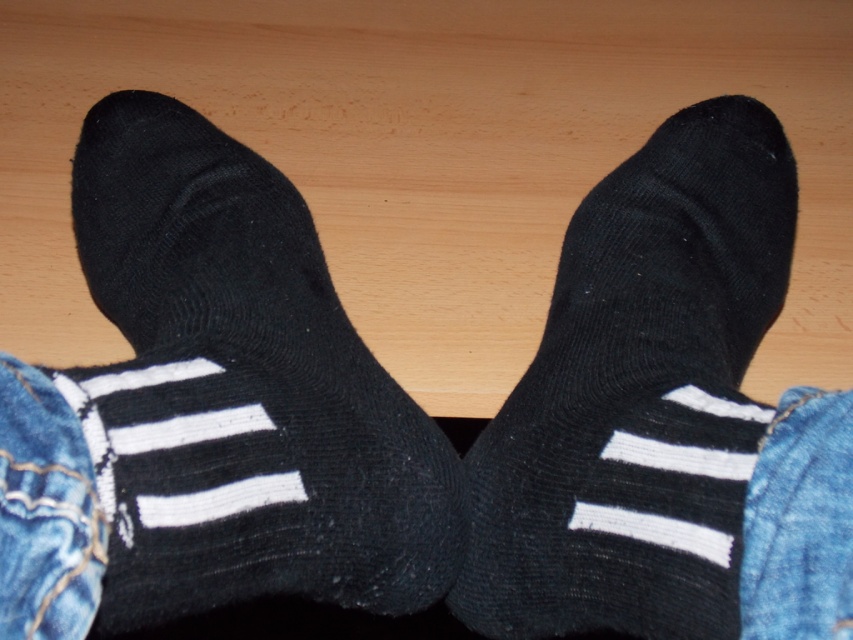
Can you confirm if black ribbed sock at left is positioned above jeans at lower left?

Correct, black ribbed sock at left is located above jeans at lower left.

Who is shorter, black ribbed sock at left or jeans at lower left?

jeans at lower left

Which is in front, point (326, 292) or point (96, 611)?

Positioned in front is point (96, 611).

Find the location of a particular element. This screenshot has height=640, width=853. black ribbed sock at left is located at coordinates (241, 390).

Is the position of black ribbed sock at left less distant than that of denim at lower right?

No, it is not.

What do you see at coordinates (241, 390) in the screenshot?
I see `black ribbed sock at left` at bounding box center [241, 390].

Describe the element at coordinates (241, 390) in the screenshot. The image size is (853, 640). I see `black ribbed sock at left` at that location.

I want to click on black ribbed sock at left, so click(x=241, y=390).

Between point (648, 330) and point (827, 624), which one is positioned in front?

Point (827, 624)

Who is positioned more to the right, black ribbed sock at center or denim at lower right?

Positioned to the right is denim at lower right.

Between point (740, 420) and point (793, 625), which one is positioned in front?

Point (793, 625) is more forward.

This screenshot has height=640, width=853. In order to click on black ribbed sock at center in this screenshot , I will do `click(639, 396)`.